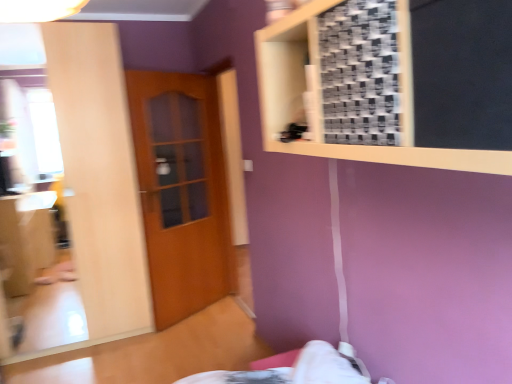
The height and width of the screenshot is (384, 512). I want to click on wooden door at center, so click(x=181, y=191).

Measure the distance between matte wooden mirror at left and camera.

matte wooden mirror at left is 9.28 feet away from camera.

Based on the photo, what is the approximate height of wooden frame at upper right?

16.59 inches.

This screenshot has width=512, height=384. What are the coordinates of `wooden door at center` in the screenshot? It's located at (181, 191).

Which of these two, wooden door at center or wooden frame at upper right, stands shorter?

wooden frame at upper right.

Does wooden door at center appear on the right side of wooden frame at upper right?

No.

Between wooden door at center and wooden frame at upper right, which one is positioned behind?

wooden door at center is further away from the camera.

Is wooden door at center turned away from wooden frame at upper right?

No, wooden door at center is not facing the opposite direction of wooden frame at upper right.

Would you consider wooden door at center to be distant from matte wooden mirror at left?

No, there isn't a large distance between wooden door at center and matte wooden mirror at left.

Between wooden door at center and matte wooden mirror at left, which one has less height?

wooden door at center.

Which is in front, wooden door at center or matte wooden mirror at left?

Positioned in front is matte wooden mirror at left.

Is wooden door at center facing towards matte wooden mirror at left?

No, wooden door at center is not turned towards matte wooden mirror at left.

In the scene shown: Which object is thinner, wooden frame at upper right or wooden door at center?

With smaller width is wooden door at center.

Which of these two, wooden frame at upper right or wooden door at center, is smaller?

With smaller size is wooden door at center.

From a real-world perspective, is wooden frame at upper right above or below wooden door at center?

wooden frame at upper right is situated higher than wooden door at center in the real world.

Considering the positions of point (295, 49) and point (138, 175), is point (295, 49) closer or farther from the camera than point (138, 175)?

Clearly, point (295, 49) is closer to the camera than point (138, 175).

Locate an element on the screen. Image resolution: width=512 pixels, height=384 pixels. door lying on the right of matte wooden mirror at left is located at coordinates (181, 191).

Is matte wooden mirror at left spatially inside wooden door at center, or outside of it?

matte wooden mirror at left is not enclosed by wooden door at center.

Which object is positioned more to the right, matte wooden mirror at left or wooden door at center?

wooden door at center.

Does point (83, 88) come in front of point (206, 202)?

That is True.

Which is more to the right, wooden frame at upper right or matte wooden mirror at left?

wooden frame at upper right is more to the right.

Is wooden frame at upper right turned away from matte wooden mirror at left?

No, wooden frame at upper right is not facing the opposite direction of matte wooden mirror at left.

Considering the relative positions of wooden frame at upper right and matte wooden mirror at left in the image provided, is wooden frame at upper right in front of matte wooden mirror at left?

Yes, wooden frame at upper right is closer to the viewer.

Is matte wooden mirror at left a part of wooden frame at upper right?

No, matte wooden mirror at left is not a part of wooden frame at upper right.

Which point is more forward, (x=126, y=160) or (x=380, y=158)?

The point (x=380, y=158) is more forward.

Where is `mirror on the left of wooden frame at upper right`? Image resolution: width=512 pixels, height=384 pixels. mirror on the left of wooden frame at upper right is located at coordinates (98, 181).

Who is bigger, matte wooden mirror at left or wooden frame at upper right?

Bigger between the two is matte wooden mirror at left.

This screenshot has height=384, width=512. What are the coordinates of `door lying below the wooden frame at upper right (from the image's perspective)` in the screenshot? It's located at (181, 191).

Locate an element on the screen. The width and height of the screenshot is (512, 384). mirror above the wooden door at center (from a real-world perspective) is located at coordinates (98, 181).

Looking at the image, which one is located further to wooden door at center, matte wooden mirror at left or wooden frame at upper right?

wooden frame at upper right is positioned further to the anchor wooden door at center.

Which object lies nearer to the anchor point wooden frame at upper right, matte wooden mirror at left or wooden door at center?

Based on the image, matte wooden mirror at left appears to be nearer to wooden frame at upper right.

When comparing their distances from wooden door at center, does wooden frame at upper right or matte wooden mirror at left seem further?

The object further to wooden door at center is wooden frame at upper right.

In the scene shown: Looking at the image, which one is located closer to wooden frame at upper right, wooden door at center or matte wooden mirror at left?

Based on the image, matte wooden mirror at left appears to be nearer to wooden frame at upper right.

Looking at the image, which one is located further to matte wooden mirror at left, wooden frame at upper right or wooden door at center?

wooden frame at upper right lies further to matte wooden mirror at left than the other object.

Looking at the image, which one is located further to matte wooden mirror at left, wooden door at center or wooden frame at upper right?

The object further to matte wooden mirror at left is wooden frame at upper right.

Where is `mirror positioned between wooden frame at upper right and wooden door at center from near to far`? The width and height of the screenshot is (512, 384). mirror positioned between wooden frame at upper right and wooden door at center from near to far is located at coordinates (98, 181).